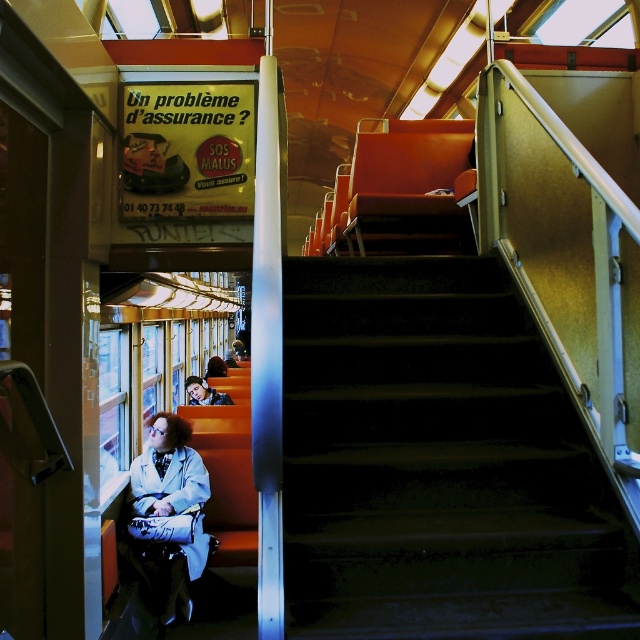
You are a passenger on the train and want to reach the upper deck. You see the dark green carpeted stairs at center and the white matte coat at lower left. Which object is closer to you as you stand at the staircase?

The dark green carpeted stairs at center is in front of the white matte coat at lower left, meaning the stairs are closer to you than the coat.

You are a person carrying a large suitcase that is 1 meter wide. You are standing at the bottom of the dark green carpeted stairs at center and want to go upstairs. Can you pass through the stairs without moving the white matte coat at lower left?

The dark green carpeted stairs at center are wider than the white matte coat at lower left. Since the stairs are wider, you can pass through them with your 1 meter wide suitcase without disturbing the white matte coat at lower left.